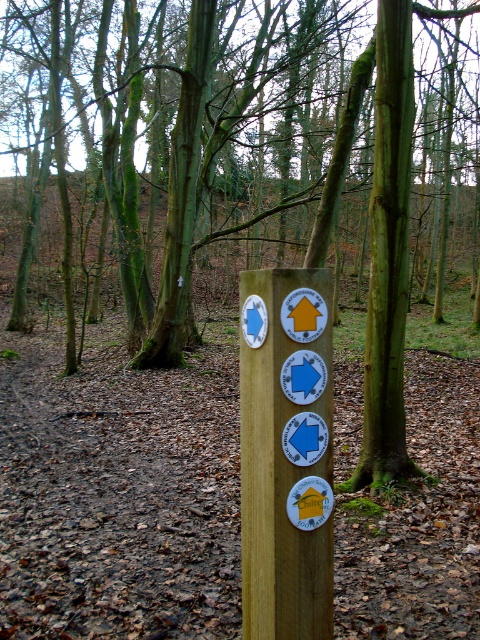
Question: Is green mossy tree at center wider than wooden signpost at center?

Choices:
 (A) no
 (B) yes

Answer: (B)

Question: Can you confirm if green mossy tree at center is wider than wooden signpost at center?

Choices:
 (A) yes
 (B) no

Answer: (A)

Question: Which object is closer to the camera taking this photo?

Choices:
 (A) green mossy tree at center
 (B) wooden signpost at center

Answer: (B)

Question: Which of the following is the farthest from the observer?

Choices:
 (A) (245, 388)
 (B) (433, 72)

Answer: (B)

Question: From the image, what is the correct spatial relationship of green mossy tree at center in relation to wooden signpost at center?

Choices:
 (A) above
 (B) below

Answer: (A)

Question: Among these points, which one is farthest from the camera?

Choices:
 (A) (298, 451)
 (B) (46, 161)

Answer: (B)